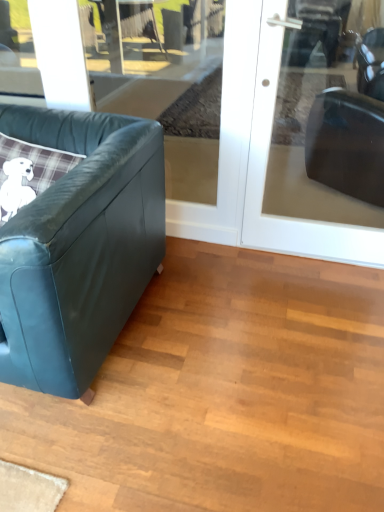
Question: Considering their positions, is transparent glass door at upper left located in front of or behind leather couch at left?

Choices:
 (A) behind
 (B) front

Answer: (A)

Question: Does point (104, 49) appear closer or farther from the camera than point (107, 138)?

Choices:
 (A) farther
 (B) closer

Answer: (A)

Question: Which is farther from the transparent glass door at upper left?

Choices:
 (A) leather couch at left
 (B) transparent glass door at upper right

Answer: (B)

Question: Which object is positioned closest to the transparent glass door at upper right?

Choices:
 (A) transparent glass door at upper left
 (B) leather couch at left

Answer: (B)